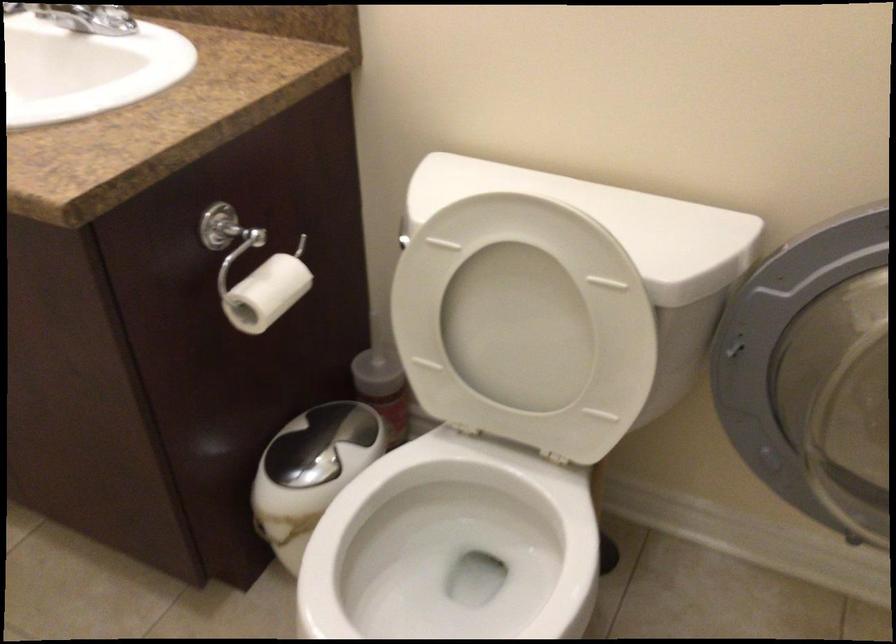
What do you see at coordinates (449, 564) in the screenshot? I see `the white toilet seat` at bounding box center [449, 564].